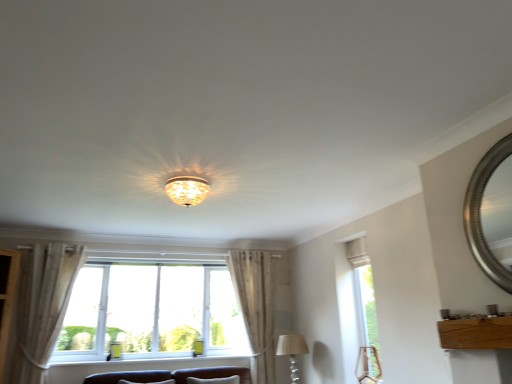
Question: Can you confirm if light beige fabric curtain at left, which is counted as the second curtain, starting from the right, is smaller than beige fabric lampshade at lower center, the first lamp positioned from the bottom?

Choices:
 (A) yes
 (B) no

Answer: (B)

Question: Is light beige fabric curtain at left, which ranks as the second curtain in back-to-front order, in front of beige fabric lampshade at lower center, marked as the 2th lamp in a left-to-right arrangement?

Choices:
 (A) no
 (B) yes

Answer: (B)

Question: From the image's perspective, is light beige fabric curtain at left, which is counted as the second curtain, starting from the right, under beige fabric lampshade at lower center, the 2th lamp positioned from the top?

Choices:
 (A) no
 (B) yes

Answer: (A)

Question: Are light beige fabric curtain at left, which is counted as the second curtain, starting from the right, and beige fabric lampshade at lower center, marked as the 2th lamp in a left-to-right arrangement, located far from each other?

Choices:
 (A) no
 (B) yes

Answer: (B)

Question: Are light beige fabric curtain at left, the 1th curtain viewed from the left, and beige fabric lampshade at lower center, the first lamp positioned from the bottom, beside each other?

Choices:
 (A) no
 (B) yes

Answer: (A)

Question: Relative to translucent glass chandelier at center, which appears as the 1th lamp when viewed from the front, is beige fabric lampshade at lower center, the 2th lamp positioned from the top, in front or behind?

Choices:
 (A) behind
 (B) front

Answer: (A)

Question: Is point (298, 352) positioned closer to the camera than point (170, 188)?

Choices:
 (A) farther
 (B) closer

Answer: (A)

Question: From a real-world perspective, relative to translucent glass chandelier at center, the first lamp positioned from the top, is beige fabric lampshade at lower center, the 2th lamp viewed from the front, vertically above or below?

Choices:
 (A) above
 (B) below

Answer: (B)

Question: Visually, is beige fabric lampshade at lower center, placed as the 1th lamp when sorted from right to left, positioned to the left or to the right of translucent glass chandelier at center, the 1th lamp from the left?

Choices:
 (A) left
 (B) right

Answer: (B)

Question: From the image's perspective, relative to white painted wood at lower center, is clear glass window at right, which is the 2th window in left-to-right order, above or below?

Choices:
 (A) above
 (B) below

Answer: (A)

Question: Is clear glass window at right, which is the 2th window in left-to-right order, wider or thinner than white painted wood at lower center?

Choices:
 (A) wide
 (B) thin

Answer: (B)

Question: Looking at the image, does clear glass window at right, which ranks as the 1th window in right-to-left order, seem bigger or smaller compared to white painted wood at lower center?

Choices:
 (A) big
 (B) small

Answer: (A)

Question: Considering their positions, is clear glass window at right, which is the 2th window in left-to-right order, located in front of or behind white painted wood at lower center?

Choices:
 (A) front
 (B) behind

Answer: (A)

Question: Considering the positions of silver metallic mirror at upper right and translucent glass chandelier at center, the first lamp positioned from the top, in the image, is silver metallic mirror at upper right wider or thinner than translucent glass chandelier at center, the first lamp positioned from the top,?

Choices:
 (A) wide
 (B) thin

Answer: (B)

Question: Is silver metallic mirror at upper right in front of or behind translucent glass chandelier at center, the first lamp positioned from the top, in the image?

Choices:
 (A) behind
 (B) front

Answer: (B)